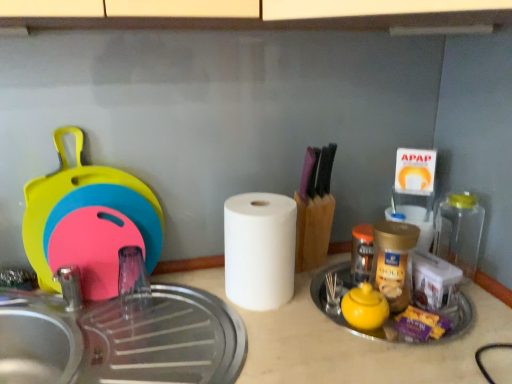
Question: Is transparent plastic bottle at right, positioned as the 1th bottle in right-to-left order, wider than golden plastic jar at center-right, which is the second bottle from right to left?

Choices:
 (A) no
 (B) yes

Answer: (A)

Question: From the image's perspective, is transparent plastic bottle at right, positioned as the 1th bottle in right-to-left order, above golden plastic jar at center-right, which is the second bottle from right to left?

Choices:
 (A) no
 (B) yes

Answer: (B)

Question: Are transparent plastic bottle at right, marked as the 3th bottle in a left-to-right arrangement, and golden plastic jar at center-right, which is the second bottle from right to left, located far from each other?

Choices:
 (A) yes
 (B) no

Answer: (B)

Question: From a real-world perspective, is transparent plastic bottle at right, positioned as the 1th bottle in right-to-left order, physically below golden plastic jar at center-right, the second bottle from the left?

Choices:
 (A) no
 (B) yes

Answer: (A)

Question: Is transparent plastic bottle at right, marked as the 3th bottle in a left-to-right arrangement, oriented towards golden plastic jar at center-right, the second bottle from the left?

Choices:
 (A) yes
 (B) no

Answer: (B)

Question: From a real-world perspective, is transparent plastic bottle at right, marked as the 3th bottle in a left-to-right arrangement, on top of golden plastic jar at center-right, which is the second bottle from right to left?

Choices:
 (A) yes
 (B) no

Answer: (A)

Question: Is white matte paper towel at center, arranged as the 1th paper towel when viewed from the back, facing towards yellow matte teapot at center-right?

Choices:
 (A) yes
 (B) no

Answer: (A)

Question: Is white matte paper towel at center, the 2th paper towel from the left, completely or partially outside of yellow matte teapot at center-right?

Choices:
 (A) no
 (B) yes

Answer: (B)

Question: Is white matte paper towel at center, the 2th paper towel from the left, wider than yellow matte teapot at center-right?

Choices:
 (A) yes
 (B) no

Answer: (B)

Question: Is there a large distance between white matte paper towel at center, the 2th paper towel from the left, and yellow matte teapot at center-right?

Choices:
 (A) no
 (B) yes

Answer: (A)

Question: Can you confirm if white matte paper towel at center, the 2th paper towel viewed from the front, is thinner than yellow matte teapot at center-right?

Choices:
 (A) no
 (B) yes

Answer: (B)

Question: Does white matte paper towel at center, the 2th paper towel from the left, appear on the left side of yellow matte teapot at center-right?

Choices:
 (A) no
 (B) yes

Answer: (A)

Question: Does white matte paper towel at center, the 2th paper towel from the left, have a greater width compared to golden plastic jar at center-right, which is the second bottle from right to left?

Choices:
 (A) yes
 (B) no

Answer: (B)